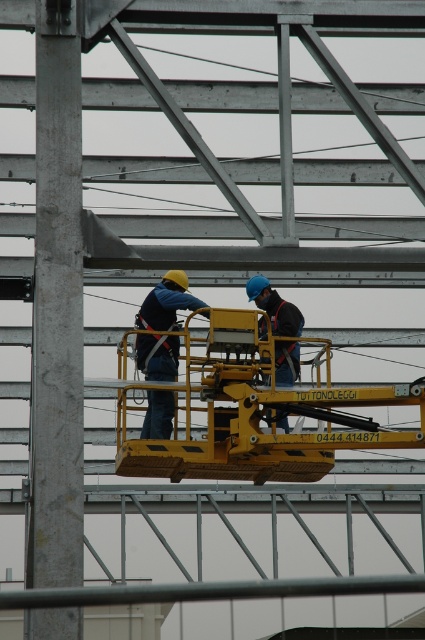
You are a safety inspector observing the construction site. You notice the yellow metallic lift at center and the matte blue safety vest at center. Which object is positioned further to the left?

The matte blue safety vest at center is positioned further to the left since the yellow metallic lift at center is to the right of it.

You are a safety inspector evaluating the equipment of two workers on a construction site. You notice the matte blue safety vest at center and the blue hard hat at center. Which piece of equipment is larger in size?

The matte blue safety vest at center is bigger than the blue hard hat at center.